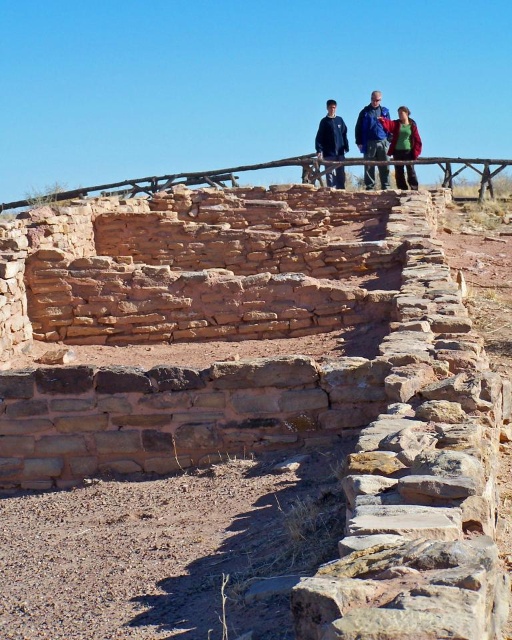
You are an archaeologist examining the site and notice the green matte jacket at upper center. Based on its coordinates, can you determine if it is closer to the foreground structures or the background sky?

The green matte jacket at upper center is located at point (401, 134), which places it closer to the upper part of the image. Since the foreground structures are in the lower part and the sky is at the top, the jacket is closer to the background sky.

You are an archaeologist standing at the base of the ancient stone structures. You notice a brown wooden rail at upper center and a blue denim jacket at upper center. Which object is closer to you?

The brown wooden rail at upper center is closer to you because it is in front of the blue denim jacket at upper center.